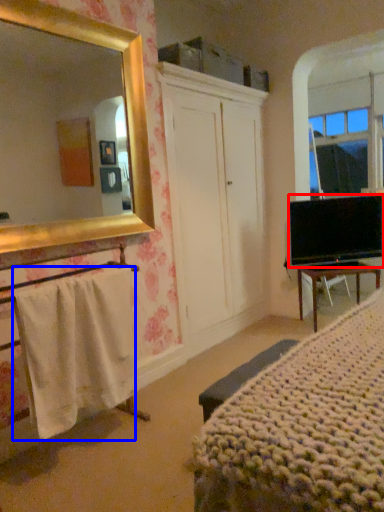
Question: Which object appears farthest to the camera in this image, television (highlighted by a red box) or towel/napkin (highlighted by a blue box)?

Choices:
 (A) television
 (B) towel/napkin

Answer: (A)